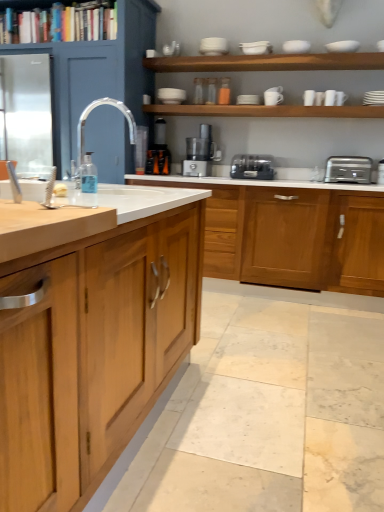
Question: Is white matte bowl at upper center, the tenth tableware viewed from the right, taller or shorter than wooden shelf at upper center, marked as the first shelf in a bottom-to-top arrangement?

Choices:
 (A) short
 (B) tall

Answer: (B)

Question: Is white matte bowl at upper center, the tenth tableware viewed from the right, situated inside wooden shelf at upper center, marked as the first shelf in a bottom-to-top arrangement, or outside?

Choices:
 (A) outside
 (B) inside

Answer: (A)

Question: Based on their relative distances, which object is farther from the translucent plastic blender at center?

Choices:
 (A) white matte bowl at upper center, the 2th tableware viewed from the left
 (B) satin silver food processor at center
 (C) white glossy bowls at upper center, acting as the eighth tableware starting from the right
 (D) polished metallic faucet at center-left
 (E) transparent plastic soap dispenser at sink

Answer: (E)

Question: Which object is positioned farthest from the silver metallic toaster at right?

Choices:
 (A) white matte plate at upper center, acting as the 3th tableware starting from the left
 (B) transparent plastic soap dispenser at sink
 (C) white matte bowl at upper center, the tenth tableware viewed from the right
 (D) wooden bookshelf at upper left, acting as the third shelf starting from the bottom
 (E) wooden shelf at upper center, marked as the first shelf in a bottom-to-top arrangement

Answer: (D)